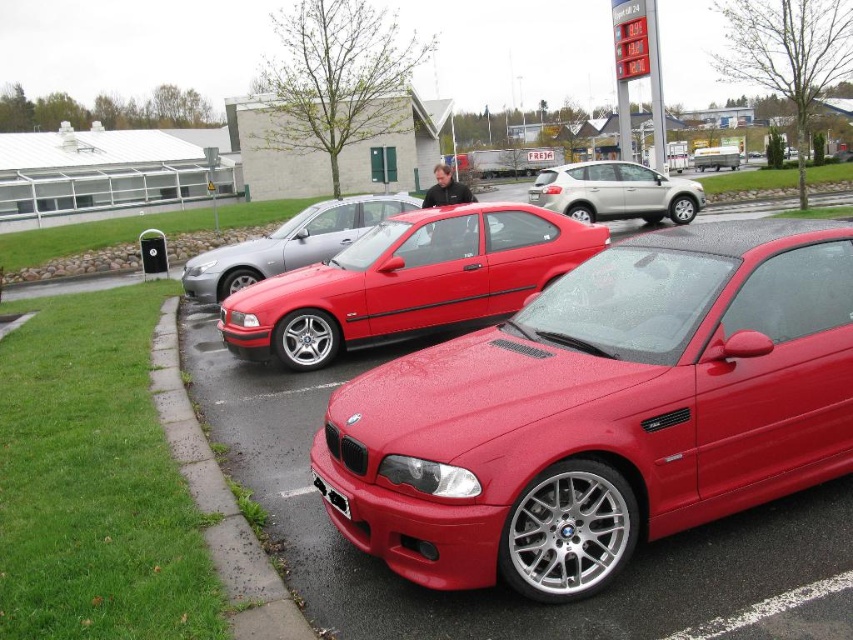
From the picture: You are a delivery driver who needs to back up your truck to the loading zone behind the shiny red car at center. Your truck requires at least 10 feet of clearance to safely maneuver. Based on the scene, is there enough space for your truck to back up safely?

The shiny red car at center is only 9.40 feet away from the camera, which means there isn not enough space for the truck to safely maneuver since it requires at least 10 feet of clearance.

You are standing at the gas station and want to locate two specific points marked in the image. The first point is at coordinate point(834, 525) and the second is at point(341, 508). Which of these two points is closer to you?

Point(834, 525) is closer to you than point(341, 508) because it is further to the viewer.

From the picture: You are a delivery driver who just arrived at the gas station. You need to place a large package on the ground near the concrete at lower left without blocking the camera. Can you do this?

The concrete at lower left and camera are 2.98 meters apart from each other, so placing the package near the concrete at lower left should not block the camera since they are more than 2 meters apart.